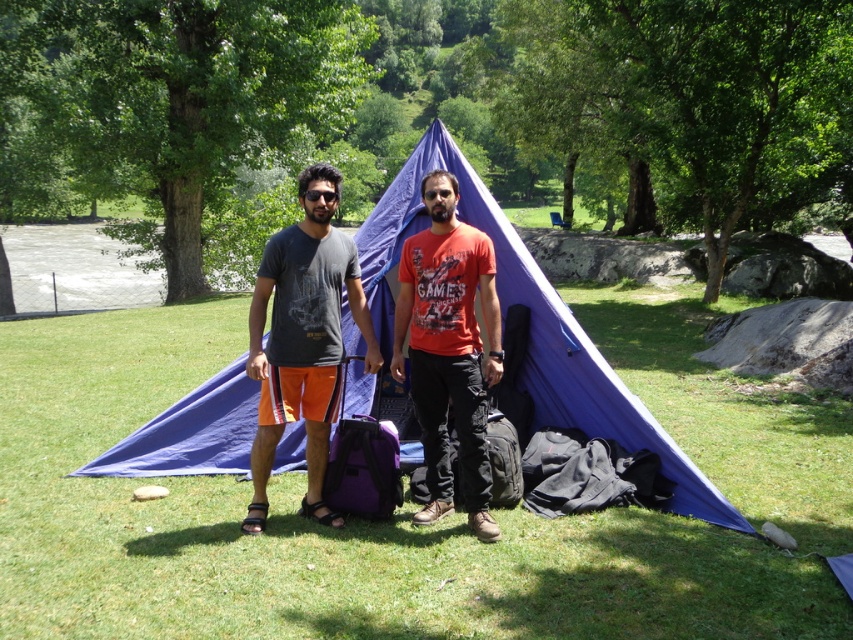
Is blue fabric tent at center to the right of matte gray t-shirt at center from the viewer's perspective?

Indeed, blue fabric tent at center is positioned on the right side of matte gray t-shirt at center.

Between blue fabric tent at center and matte gray t-shirt at center, which one appears on the right side from the viewer's perspective?

Positioned to the right is blue fabric tent at center.

Describe the element at coordinates (531, 326) in the screenshot. The width and height of the screenshot is (853, 640). I see `blue fabric tent at center` at that location.

The height and width of the screenshot is (640, 853). What are the coordinates of `blue fabric tent at center` in the screenshot? It's located at (531, 326).

Which of these two, blue fabric tent at center or matte orange t-shirt at center, stands shorter?

blue fabric tent at center

Is blue fabric tent at center closer to camera compared to matte orange t-shirt at center?

No.

Does point (138, 433) come closer to viewer compared to point (438, 240)?

No, (138, 433) is behind (438, 240).

You are a GUI agent. You are given a task and a screenshot of the screen. Output one action in this format:
    pyautogui.click(x=<x>, y=<y>)
    Task: Click on the blue fabric tent at center
    Image resolution: width=853 pixels, height=640 pixels.
    Given the screenshot: What is the action you would take?
    pos(531,326)

Can you confirm if matte gray t-shirt at center is positioned below matte orange t-shirt at center?

No, matte gray t-shirt at center is not below matte orange t-shirt at center.

Which of these two, matte gray t-shirt at center or matte orange t-shirt at center, stands shorter?

matte gray t-shirt at center

Where is `matte gray t-shirt at center`? The image size is (853, 640). matte gray t-shirt at center is located at coordinates (303, 339).